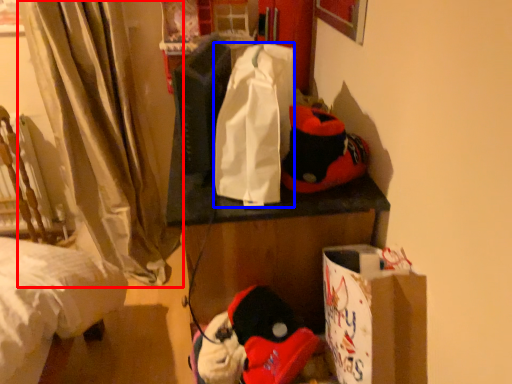
Question: Which object is closer to the camera taking this photo, curtain (highlighted by a red box) or tote bag (highlighted by a blue box)?

Choices:
 (A) curtain
 (B) tote bag

Answer: (B)